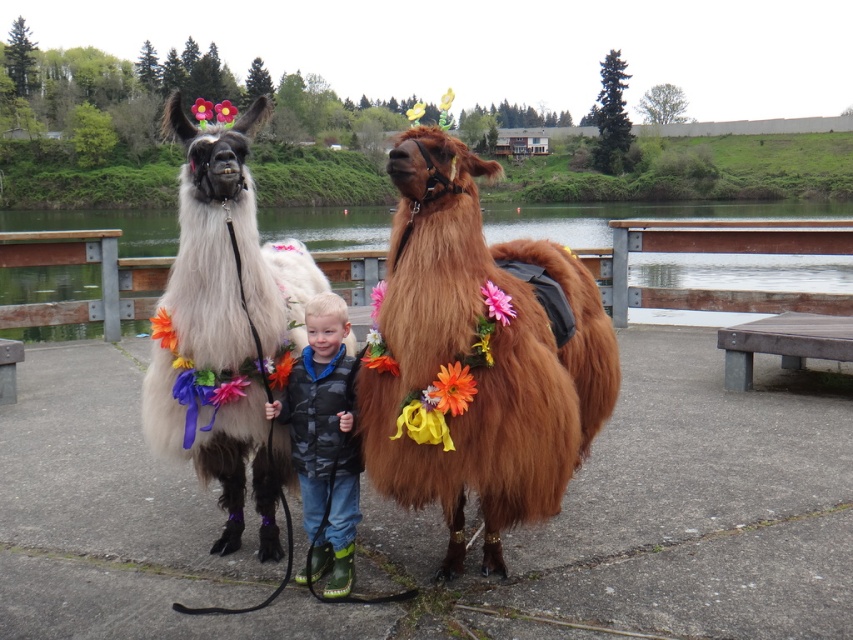
Question: Is white fluffy alpaca at center to the left of camouflage jacket at center from the viewer's perspective?

Choices:
 (A) yes
 (B) no

Answer: (A)

Question: Which object appears closest to the camera in this image?

Choices:
 (A) white fluffy alpaca at center
 (B) brown fuzzy camel at center
 (C) camouflage jacket at center

Answer: (B)

Question: Which point is closer to the camera?

Choices:
 (A) (498, 308)
 (B) (194, 177)
 (C) (317, 577)

Answer: (A)

Question: Which object is the farthest from the brown fuzzy camel at center?

Choices:
 (A) white fluffy alpaca at center
 (B) camouflage jacket at center

Answer: (A)

Question: Considering the relative positions of brown fuzzy camel at center and camouflage jacket at center in the image provided, where is brown fuzzy camel at center located with respect to camouflage jacket at center?

Choices:
 (A) below
 (B) above

Answer: (B)

Question: Does brown fuzzy camel at center appear over camouflage jacket at center?

Choices:
 (A) no
 (B) yes

Answer: (B)